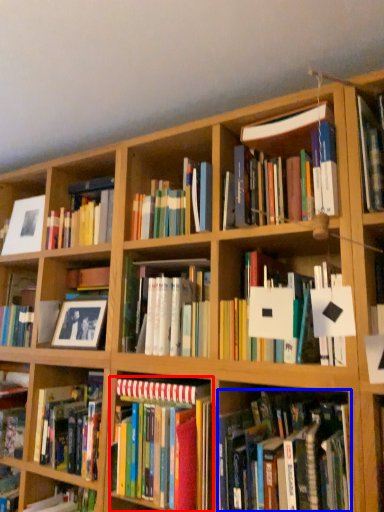
Question: Among these objects, which one is farthest to the camera, book (highlighted by a red box) or book (highlighted by a blue box)?

Choices:
 (A) book
 (B) book

Answer: (A)